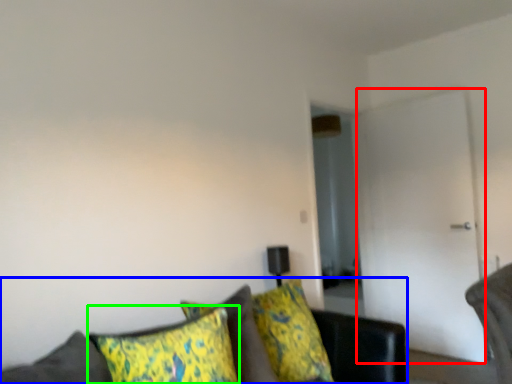
Question: Considering the real-world distances, which object is farthest from glass door (highlighted by a red box)? studio couch (highlighted by a blue box) or pillow (highlighted by a green box)?

Choices:
 (A) studio couch
 (B) pillow

Answer: (B)